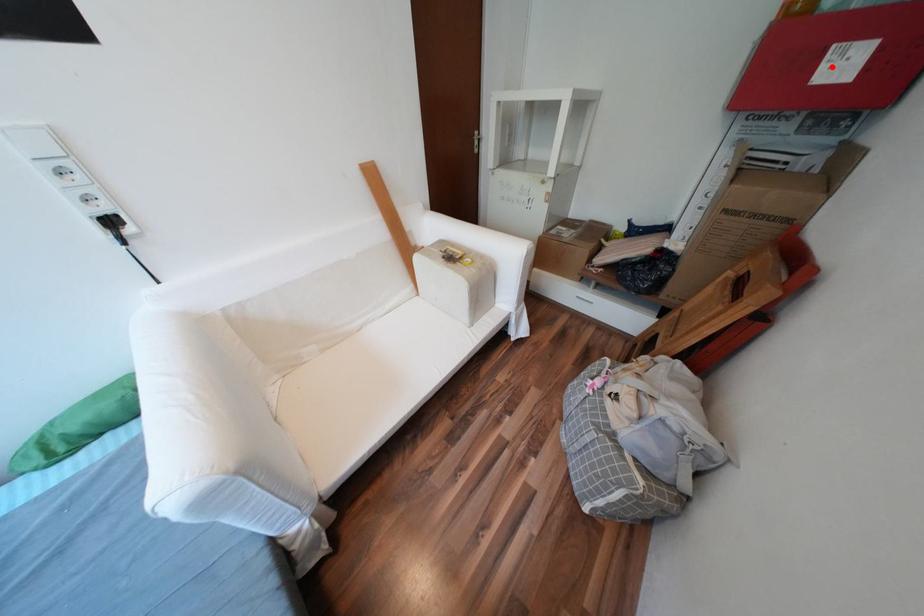
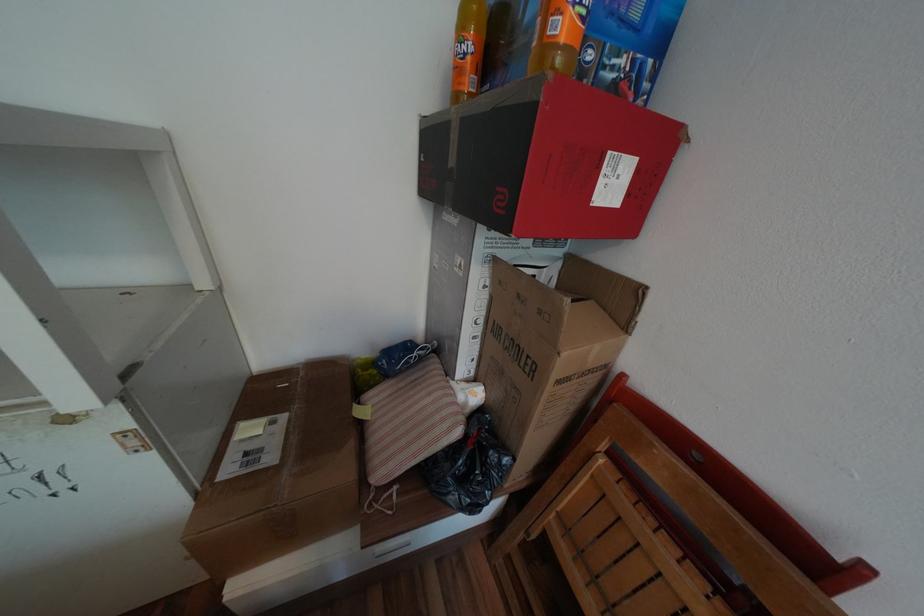
Question: I am providing you with two images of the same scene from different viewpoints. A red point is shown in image1. For the corresponding object point in image2, is it positioned nearer or farther from the camera?

Choices:
 (A) Nearer
 (B) Farther

Answer: (A)